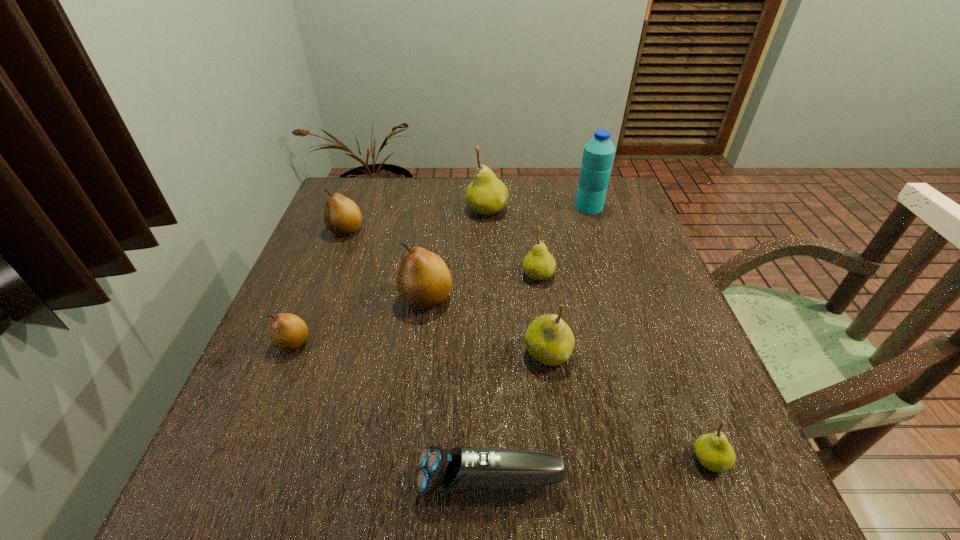
Identify which green pear is located as the second nearest to the farthest brown pear. Please provide its 2D coordinates. Your answer should be formatted as a tuple, i.e. [(x, y)], where the tuple contains the x and y coordinates of a point satisfying the conditions above.

[(539, 264)]

Locate an element on the screen. Image resolution: width=960 pixels, height=540 pixels. brown pear identified as the closest to the farthest brown pear is located at coordinates (423, 280).

Locate an element on the screen. This screenshot has width=960, height=540. brown pear identified as the third closest to the second farthest green pear is located at coordinates (287, 332).

The width and height of the screenshot is (960, 540). What are the coordinates of `free spot that satisfies the following two spatial constraints: 1. on the front side of the third nearest green pear; 2. on the right side of the smallest green pear` in the screenshot? It's located at (565, 460).

Find the location of a particular element. The height and width of the screenshot is (540, 960). vacant point that satisfies the following two spatial constraints: 1. on the back side of the blue water bottle; 2. on the left side of the second smallest green pear is located at coordinates (528, 206).

The image size is (960, 540). I want to click on vacant space that satisfies the following two spatial constraints: 1. on the front side of the third smallest green pear; 2. on the right side of the leftmost green pear, so [x=490, y=353].

Where is `free space that satisfies the following two spatial constraints: 1. on the front side of the second biggest green pear; 2. on the head of the electric shaver`? free space that satisfies the following two spatial constraints: 1. on the front side of the second biggest green pear; 2. on the head of the electric shaver is located at coordinates (566, 481).